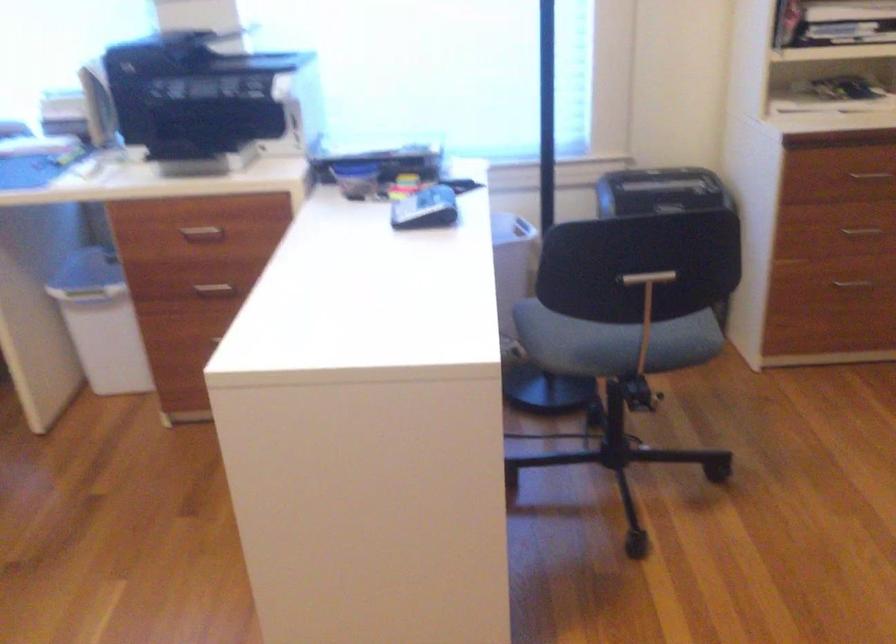
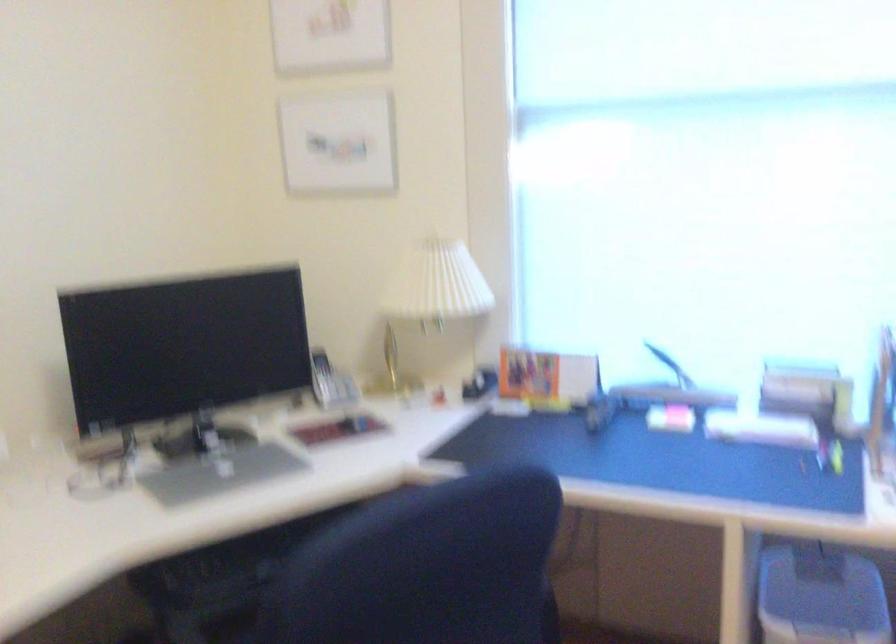
Question: The images are taken continuously from a first-person perspective. In which direction is your viewpoint rotating?

Choices:
 (A) Left
 (B) Right
 (C) Up
 (D) Down

Answer: (A)